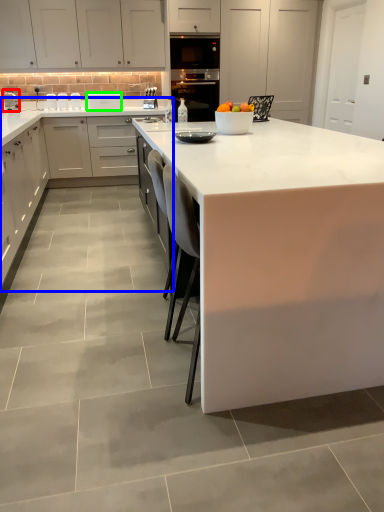
Question: Estimate the real-world distances between objects in this image. Which object is closer to appliance (highlighted by a red box), countertop (highlighted by a blue box) or kitchen appliance (highlighted by a green box)?

Choices:
 (A) countertop
 (B) kitchen appliance

Answer: (B)